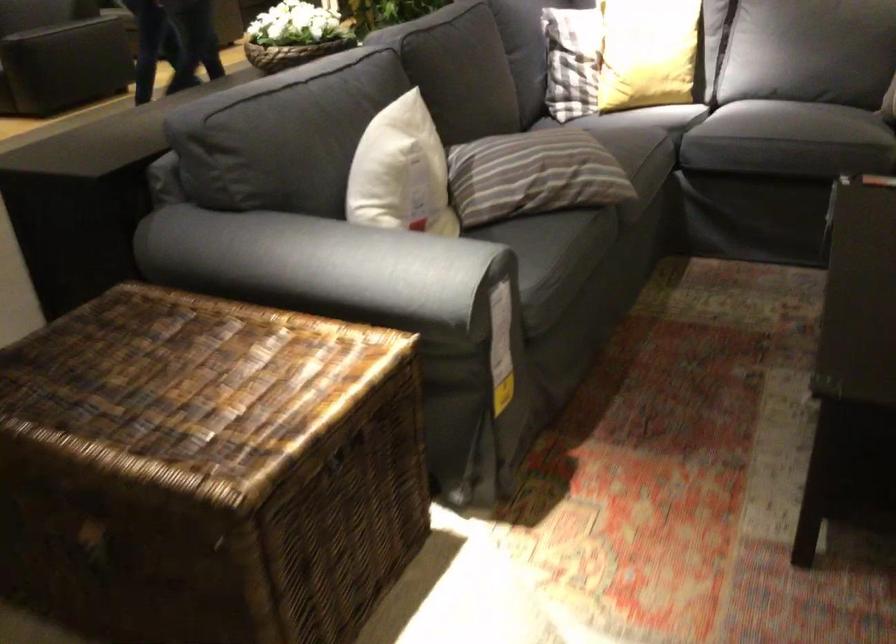
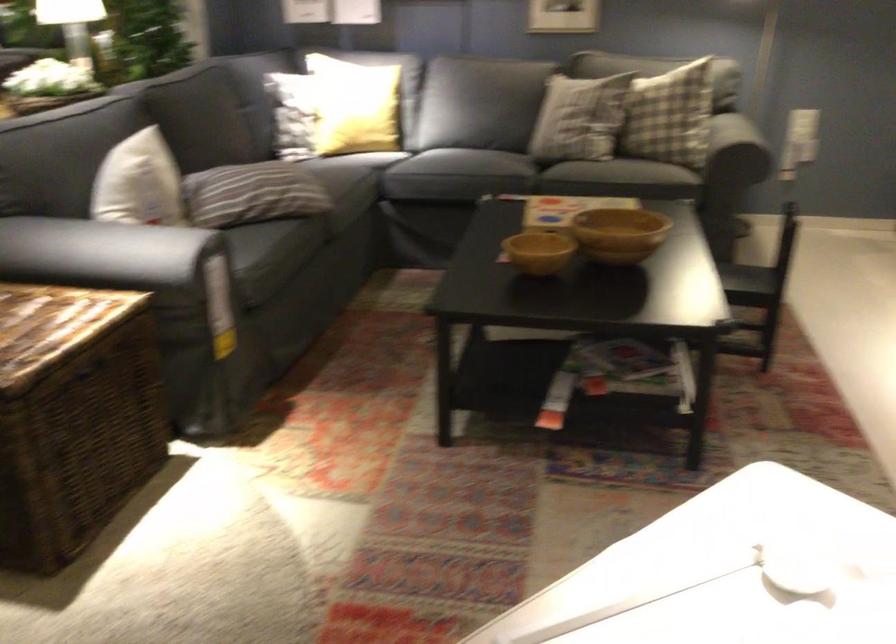
The point at [400,174] is marked in the first image. Where is the corresponding point in the second image?

(139, 183)